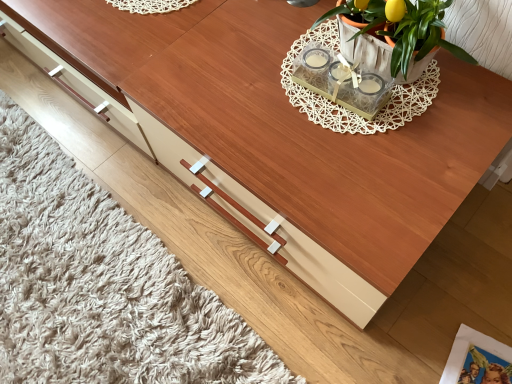
Question: Is terracotta clay pot at upper right wider or thinner than printed paper magazine at lower right?

Choices:
 (A) wide
 (B) thin

Answer: (B)

Question: Considering the positions of point (355, 49) and point (457, 364), is point (355, 49) closer or farther from the camera than point (457, 364)?

Choices:
 (A) closer
 (B) farther

Answer: (A)

Question: From the image's perspective, relative to printed paper magazine at lower right, is terracotta clay pot at upper right above or below?

Choices:
 (A) above
 (B) below

Answer: (A)

Question: From a real-world perspective, is printed paper magazine at lower right physically located above or below terracotta clay pot at upper right?

Choices:
 (A) above
 (B) below

Answer: (B)

Question: Considering their positions, is printed paper magazine at lower right located in front of or behind terracotta clay pot at upper right?

Choices:
 (A) front
 (B) behind

Answer: (B)

Question: Is point (482, 342) positioned closer to the camera than point (408, 67)?

Choices:
 (A) closer
 (B) farther

Answer: (B)

Question: Is printed paper magazine at lower right spatially inside terracotta clay pot at upper right, or outside of it?

Choices:
 (A) outside
 (B) inside

Answer: (A)